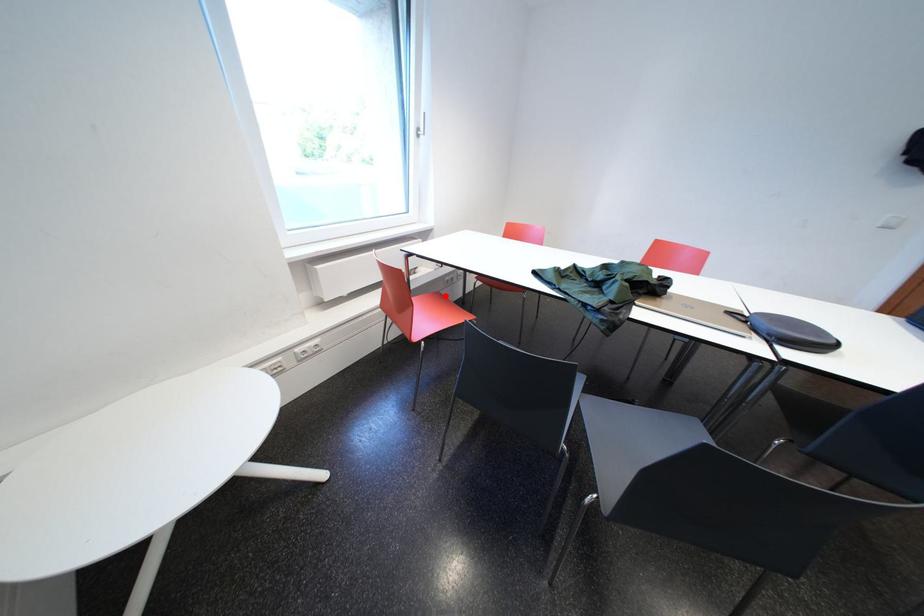
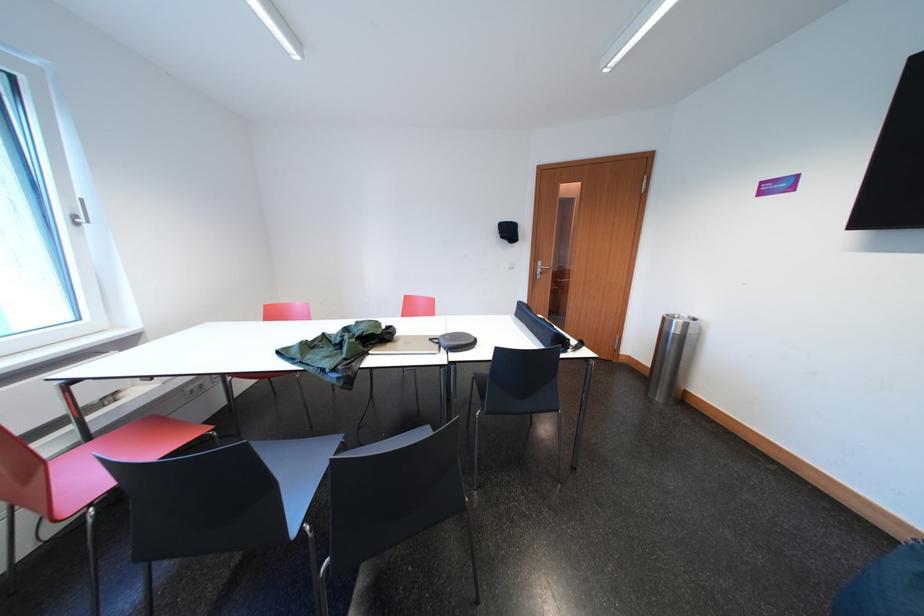
Question: I am providing you with two images of the same scene from different viewpoints. Given a red point in image1, look at the same physical point in image2. Is it:

Choices:
 (A) Closer to the viewpoint
 (B) Farther from the viewpoint

Answer: (B)